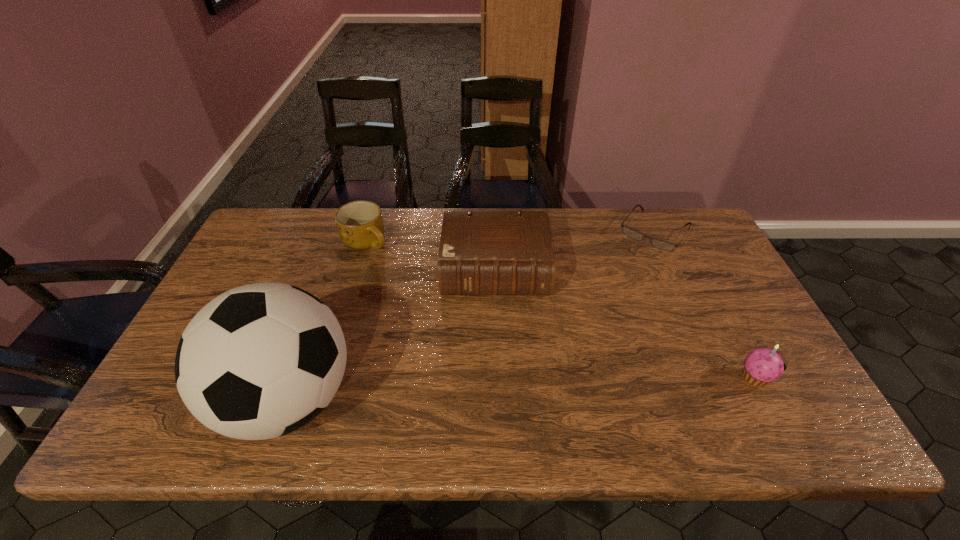
This screenshot has width=960, height=540. In order to click on vacant space positioned 0.110m on the side with the handle of the fourth tallest object in this screenshot , I will do `click(392, 277)`.

In order to click on free spot located on the side with the handle of the fourth tallest object in this screenshot , I will do `click(386, 269)`.

Locate an element on the screen. vacant position located 0.130m on the spine side of the third object from left to right is located at coordinates (495, 341).

You are a GUI agent. You are given a task and a screenshot of the screen. Output one action in this format:
    pyautogui.click(x=<x>, y=<y>)
    Task: Click on the free spot located 0.280m on the spine side of the third object from left to right
    
    Given the screenshot: What is the action you would take?
    pyautogui.click(x=495, y=392)

At what (x,y) coordinates should I click in order to perform the action: click on free region located 0.260m on the spine side of the third object from left to right. Please return your answer as a coordinate pair (x, y). Looking at the image, I should click on (495, 384).

At what (x,y) coordinates should I click in order to perform the action: click on spectacles present at the far edge. Please return your answer as a coordinate pair (x, y). Looking at the image, I should click on (659, 244).

I want to click on mug positioned at the far edge, so click(x=360, y=225).

This screenshot has width=960, height=540. I want to click on Bible at the far edge, so click(x=484, y=253).

Locate an element on the screen. soccer ball located at the near edge is located at coordinates (259, 361).

Where is `cupcake that is at the near edge`? The width and height of the screenshot is (960, 540). cupcake that is at the near edge is located at coordinates (762, 365).